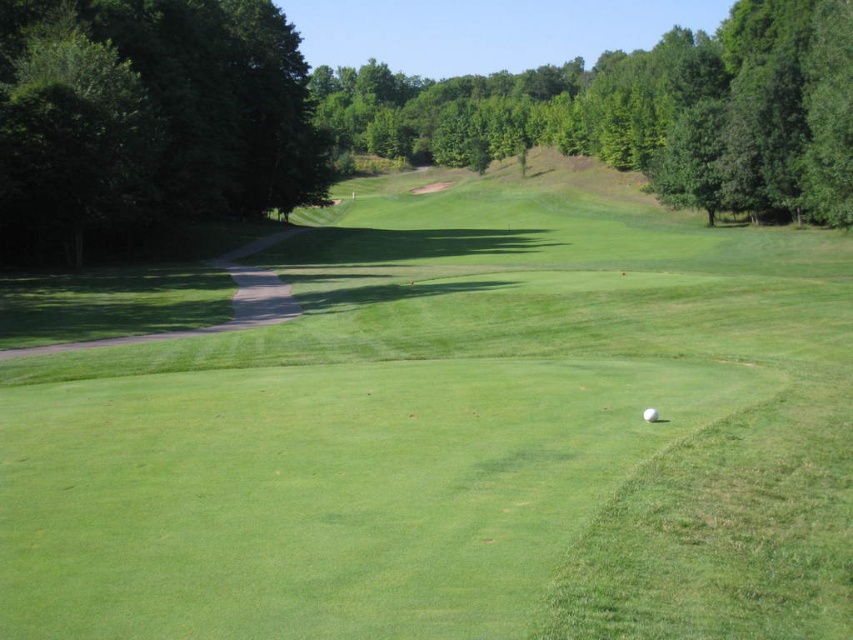
You are a golfer standing at the edge of the fairway near the green leafy tree at left. You want to hit the white matte golf ball at center into the hole located beyond the elevated area. Considering the position of the tree, will the tree block your direct line of sight to the golf ball?

The green leafy tree at left is positioned on the left side of the white matte golf ball at center, so it will not block your direct line of sight to the golf ball.

You are a golfer standing on the fairway and want to hit your ball towards the elevated area. Which tree, the green leafy tree at left or the green leafy tree at upper center, is taller and could potentially block your shot?

The green leafy tree at upper center is taller than the green leafy tree at left, so it could potentially block your shot more than the green leafy tree at left.

You are a golfer standing at the center of the fairway. You want to hit the golf ball towards the elevated area but need to avoid the green leafy tree at left. Based on the tree location, which direction should you aim your shot to avoid it?

The green leafy tree at left is located at point (148, 116), which is to the left side of the fairway. To avoid it, you should aim your shot towards the right side of the fairway.